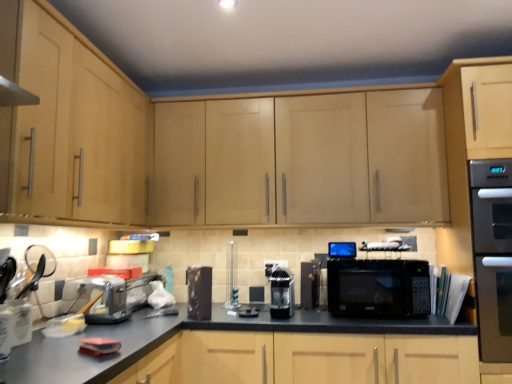
Question: Is point (504, 311) positioned closer to the camera than point (291, 205)?

Choices:
 (A) closer
 (B) farther

Answer: (A)

Question: From a real-world perspective, is stainless steel oven at right above or below light wood cabinet at upper center, the first cabinetry when ordered from right to left?

Choices:
 (A) above
 (B) below

Answer: (B)

Question: Which is farther from the black glossy coffee maker at center, which is the 2th appliance from left to right?

Choices:
 (A) black matte microwave at center
 (B) black plastic microwave at center, acting as the 2th appliance starting from the right
 (C) stainless steel oven at right
 (D) metallic silver toaster at left, the 5th appliance in the right-to-left sequence
 (E) light wood cabinet at upper center, the first cabinetry when ordered from right to left

Answer: (C)

Question: Based on their relative distances, which object is nearer to the stainless steel oven at right?

Choices:
 (A) black glossy microwave at center, the 5th appliance from the left
 (B) light wood cabinet at upper center, the second cabinetry viewed from the left
 (C) black matte microwave at center
 (D) light wood cabinet at left, marked as the second cabinetry in a right-to-left arrangement
 (E) black plastic microwave at center, which is the 4th appliance from left to right

Answer: (C)